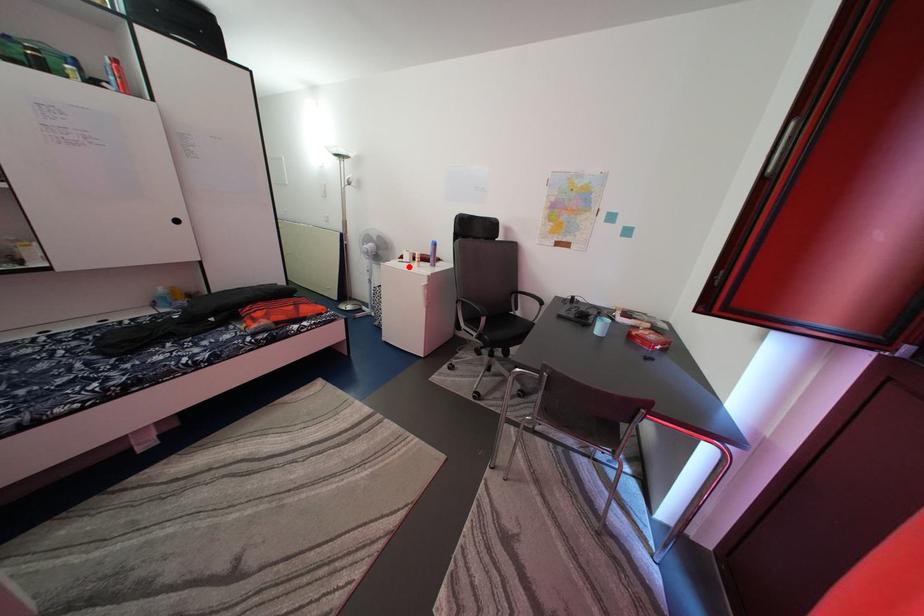
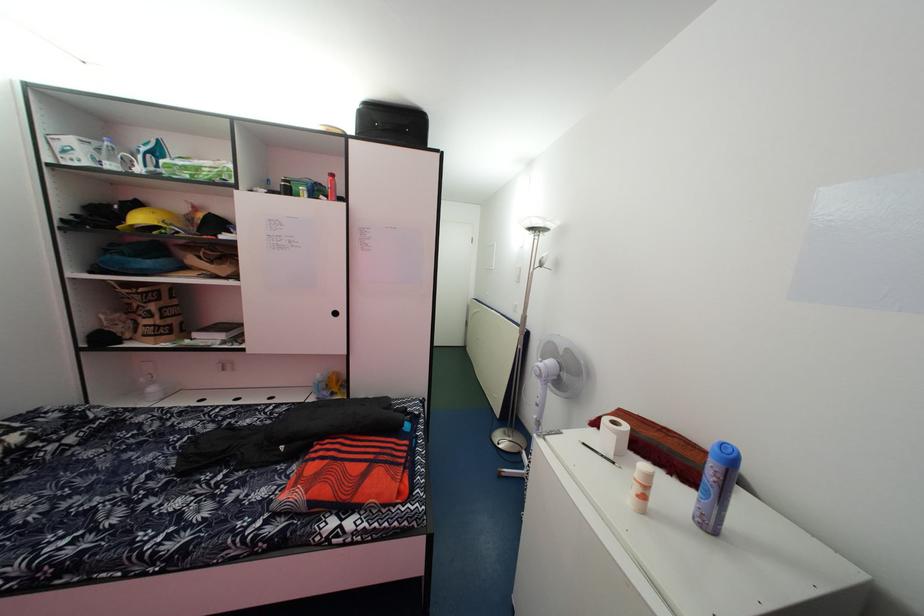
The point at the highlighted location is marked in the first image. Where is the corresponding point in the second image?

(600, 442)